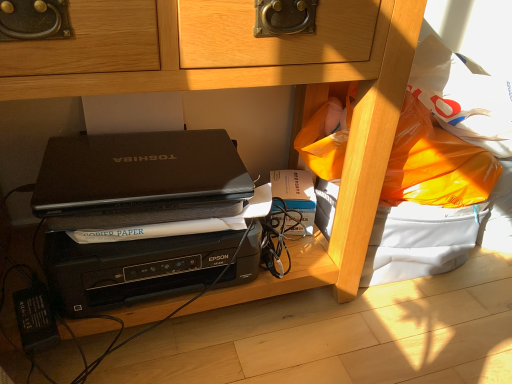
Question: Is matte black laptop at center facing towards black matte laptop at center?

Choices:
 (A) no
 (B) yes

Answer: (A)

Question: From a real-world perspective, is matte black laptop at center on top of black matte laptop at center?

Choices:
 (A) yes
 (B) no

Answer: (A)

Question: Considering the relative positions of matte black laptop at center and black matte laptop at center in the image provided, is matte black laptop at center to the left of black matte laptop at center from the viewer's perspective?

Choices:
 (A) yes
 (B) no

Answer: (B)

Question: Is matte black laptop at center beside black matte laptop at center?

Choices:
 (A) yes
 (B) no

Answer: (B)

Question: Is matte black laptop at center smaller than black matte laptop at center?

Choices:
 (A) yes
 (B) no

Answer: (A)

Question: Considering the positions of point (117, 177) and point (147, 241), is point (117, 177) closer or farther from the camera than point (147, 241)?

Choices:
 (A) closer
 (B) farther

Answer: (B)

Question: From the image's perspective, is matte black laptop at center above or below black matte laptop at center?

Choices:
 (A) above
 (B) below

Answer: (A)

Question: Relative to black matte laptop at center, is matte black laptop at center in front or behind?

Choices:
 (A) behind
 (B) front

Answer: (B)

Question: Is matte black laptop at center wider or thinner than black matte laptop at center?

Choices:
 (A) wide
 (B) thin

Answer: (B)

Question: Considering the positions of point (297, 183) and point (141, 144), is point (297, 183) closer or farther from the camera than point (141, 144)?

Choices:
 (A) closer
 (B) farther

Answer: (B)

Question: In terms of height, does hardcover book at center look taller or shorter compared to black matte laptop at center?

Choices:
 (A) tall
 (B) short

Answer: (B)

Question: From a real-world perspective, is hardcover book at center physically located above or below black matte laptop at center?

Choices:
 (A) below
 (B) above

Answer: (A)

Question: Is hardcover book at center wider or thinner than black matte laptop at center?

Choices:
 (A) wide
 (B) thin

Answer: (B)

Question: From a real-world perspective, is hardcover book at center above or below matte black laptop at center?

Choices:
 (A) below
 (B) above

Answer: (A)

Question: Is point (298, 190) closer or farther from the camera than point (226, 165)?

Choices:
 (A) closer
 (B) farther

Answer: (A)